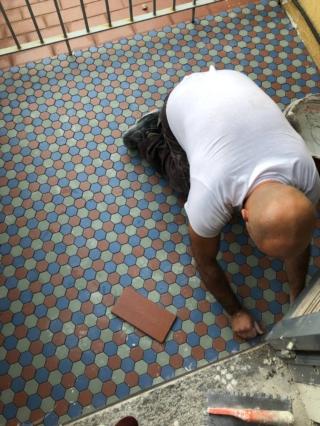
This screenshot has width=320, height=426. I want to click on door, so click(297, 331).